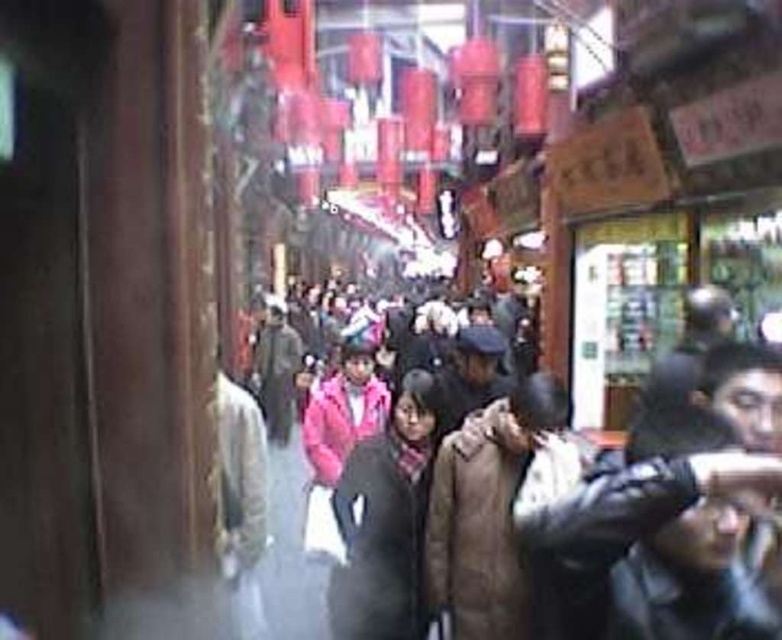
You are standing in the market and see both the dark brown down jacket at center and the dark gray fur coat at center. Which one is positioned to the right side of the other?

The dark brown down jacket at center is to the right of the dark gray fur coat at center.

You are standing at the entrance of the market and want to find the dark brown down jacket at center. According to the coordinates provided, in which direction should you move to locate it?

The dark brown down jacket at center is located at coordinates point (x=551, y=538). Since you are at the entrance, you should move towards the center of the market to reach it.